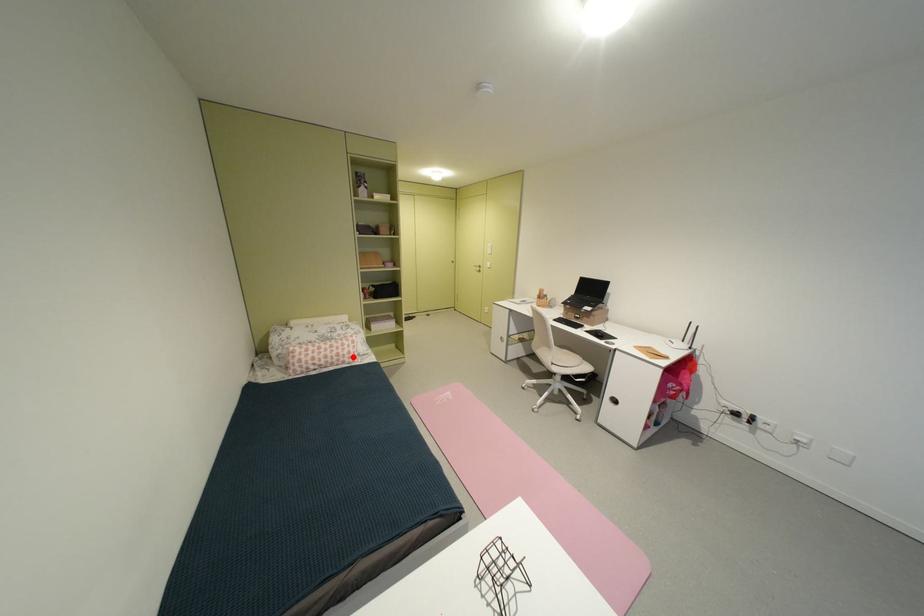
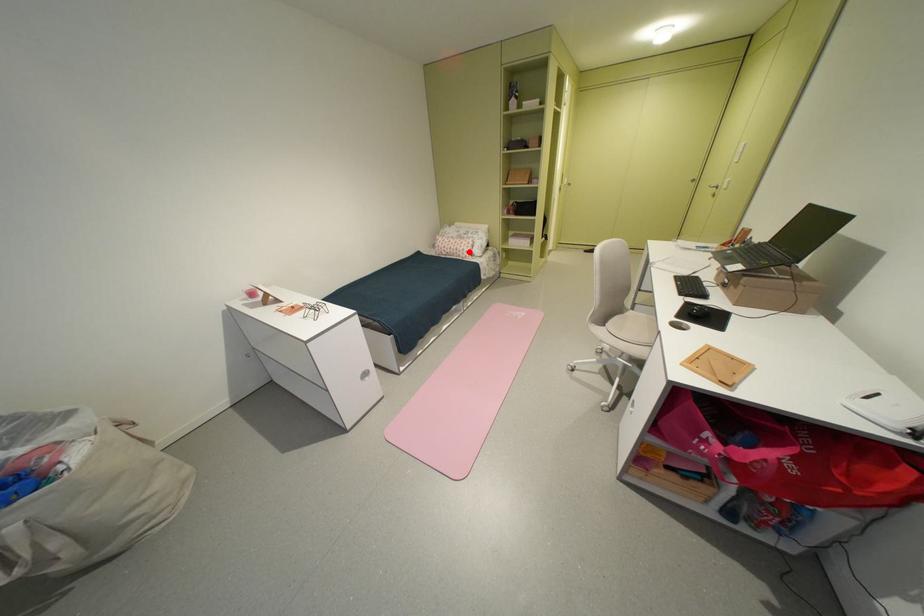
I am providing you with two images of the same scene from different viewpoints. A red point is marked on the first image and another point is marked on the second image. Does the point marked in image1 correspond to the same location as the one in image2?

Yes